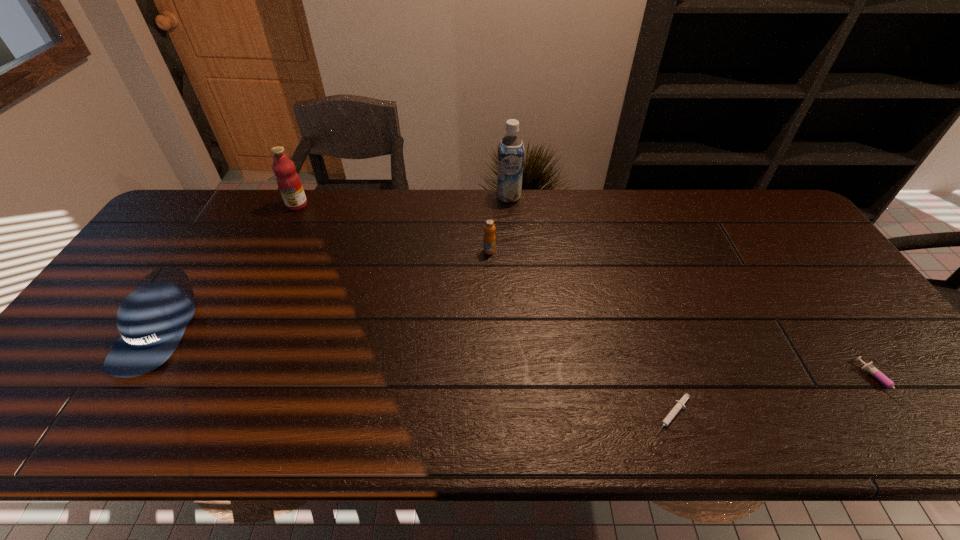
Where is `the tallest object`? Image resolution: width=960 pixels, height=540 pixels. the tallest object is located at coordinates (511, 148).

The height and width of the screenshot is (540, 960). I want to click on the third object from right to left, so click(511, 148).

Locate an element on the screen. This screenshot has width=960, height=540. the second object from left to right is located at coordinates (288, 180).

Locate an element on the screen. Image resolution: width=960 pixels, height=540 pixels. the fifth shortest object is located at coordinates (288, 180).

Identify the location of orange juice. The width and height of the screenshot is (960, 540). (489, 237).

This screenshot has height=540, width=960. I want to click on the fourth object from right to left, so click(x=489, y=237).

Find the location of a particular element. Image resolution: width=960 pixels, height=540 pixels. baseball cap is located at coordinates (152, 319).

Locate an element on the screen. the right syringe is located at coordinates pos(870,368).

The width and height of the screenshot is (960, 540). Find the location of `the rightmost object`. the rightmost object is located at coordinates (870, 368).

This screenshot has width=960, height=540. I want to click on the shorter syringe, so click(x=679, y=404).